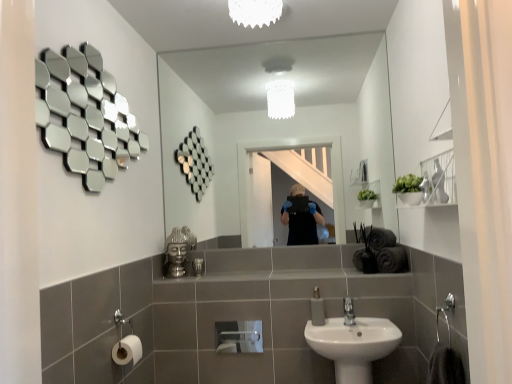
Image resolution: width=512 pixels, height=384 pixels. What are the coordinates of `empty space that is to the right of silver metallic faucet at lower center` in the screenshot? It's located at (374, 320).